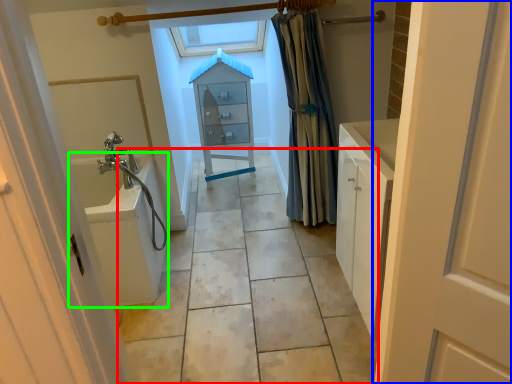
Question: Based on their relative distances, which object is farther from path (highlighted by a red box)? Choose from door (highlighted by a blue box) and bath (highlighted by a green box).

Choices:
 (A) door
 (B) bath

Answer: (A)